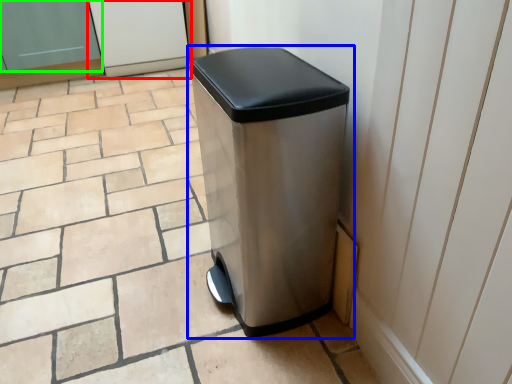
Question: Which object is the farthest from screen door (highlighted by a red box)? Choose among these: waste container (highlighted by a blue box) or screen door (highlighted by a green box).

Choices:
 (A) waste container
 (B) screen door

Answer: (A)